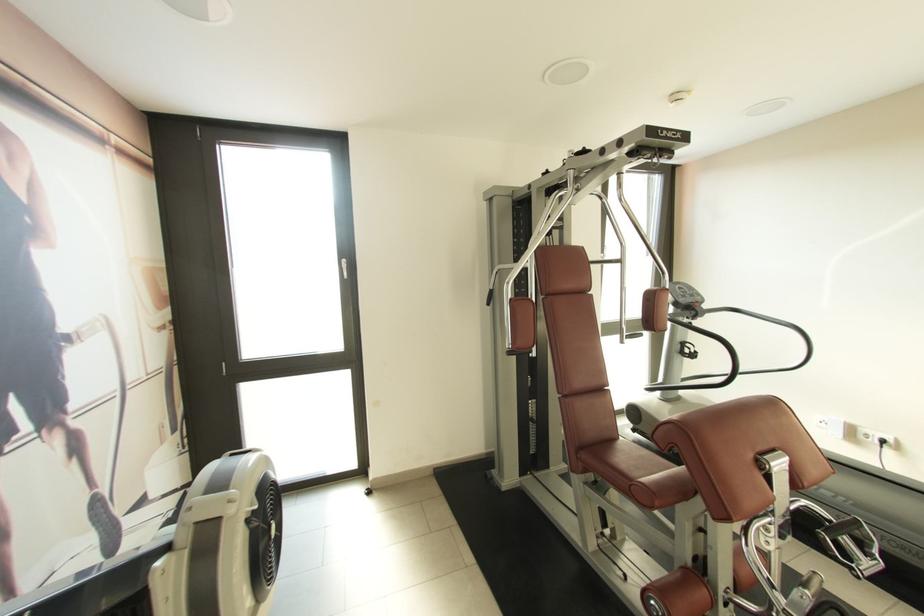
Describe the element at coordinates (494, 280) in the screenshot. I see `the silver exercise handle` at that location.